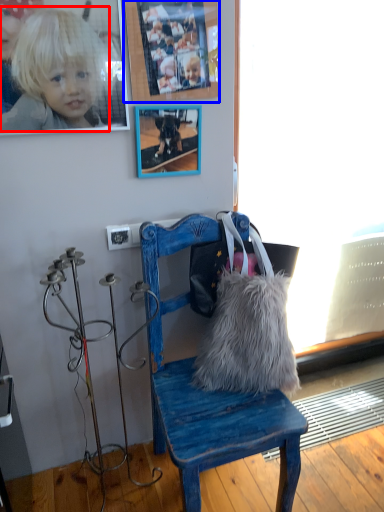
Question: Which object appears closest to the camera in this image, person (highlighted by a red box) or picture frame (highlighted by a blue box)?

Choices:
 (A) person
 (B) picture frame

Answer: (A)